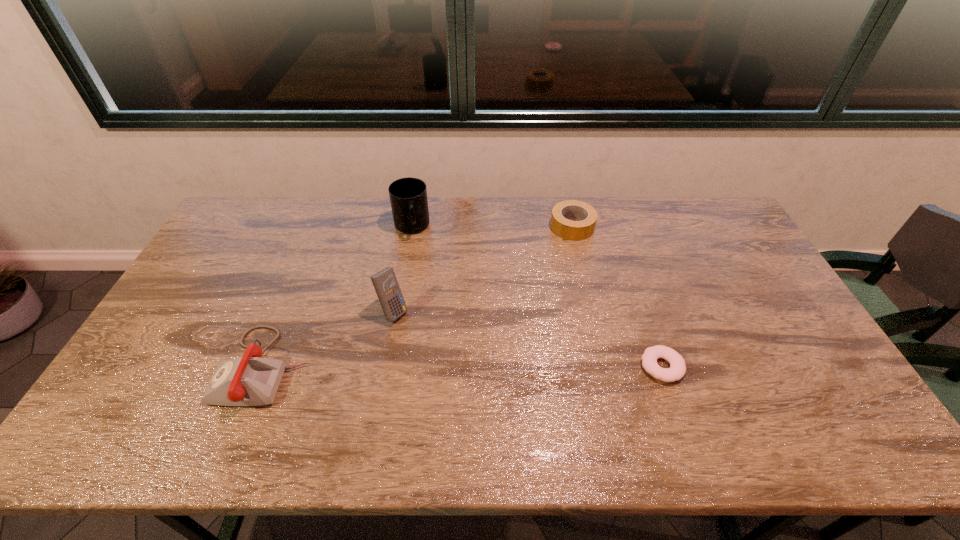
Find the location of `the third closest object relative to the shortest object`. the third closest object relative to the shortest object is located at coordinates (x=408, y=196).

Where is `blank space that satisfies the following two spatial constraints: 1. on the front side of the shortest object; 2. on the left side of the mug`? Image resolution: width=960 pixels, height=540 pixels. blank space that satisfies the following two spatial constraints: 1. on the front side of the shortest object; 2. on the left side of the mug is located at coordinates (387, 367).

What are the coordinates of `free space that satisfies the following two spatial constraints: 1. on the back side of the mug; 2. on the right side of the calculator` in the screenshot? It's located at click(x=408, y=227).